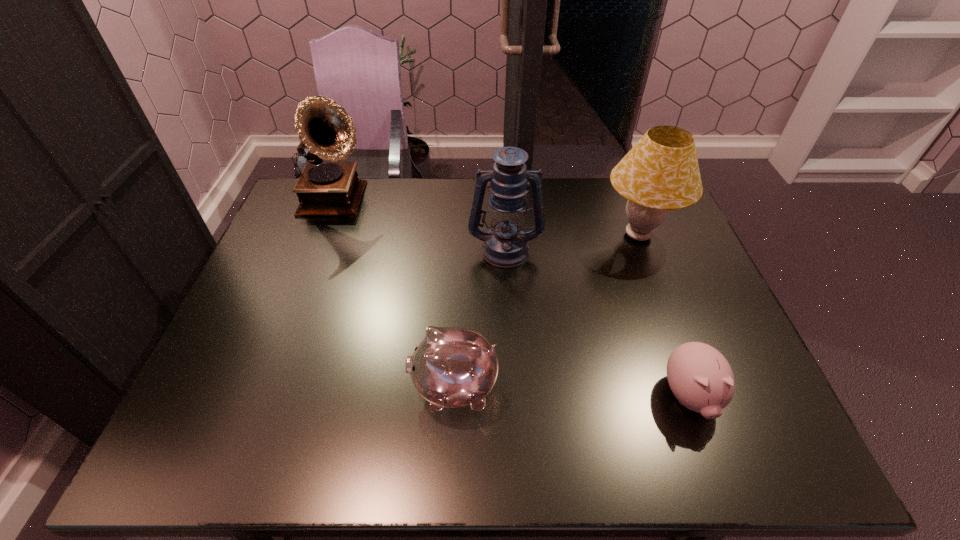
The image size is (960, 540). Identify the location of record player. (325, 188).

Where is `lantern`? Image resolution: width=960 pixels, height=540 pixels. lantern is located at coordinates (505, 245).

This screenshot has height=540, width=960. I want to click on lampshade, so click(x=660, y=173).

The width and height of the screenshot is (960, 540). Find the location of `the left piggy bank`. the left piggy bank is located at coordinates (453, 367).

Find the location of a particular element. This screenshot has height=540, width=960. the taller piggy bank is located at coordinates (453, 367).

Where is `the right piggy bank`? The height and width of the screenshot is (540, 960). the right piggy bank is located at coordinates (700, 377).

Find the location of `the shorter piggy bank`. the shorter piggy bank is located at coordinates (700, 377).

Where is `vacant region located 0.300m on the horn of the leftmost object`? vacant region located 0.300m on the horn of the leftmost object is located at coordinates (461, 202).

The height and width of the screenshot is (540, 960). Find the location of `free space located 0.220m on the front-facing side of the lantern`. free space located 0.220m on the front-facing side of the lantern is located at coordinates (510, 328).

Where is `free region located 0.350m on the front of the lampshade`? The height and width of the screenshot is (540, 960). free region located 0.350m on the front of the lampshade is located at coordinates (688, 366).